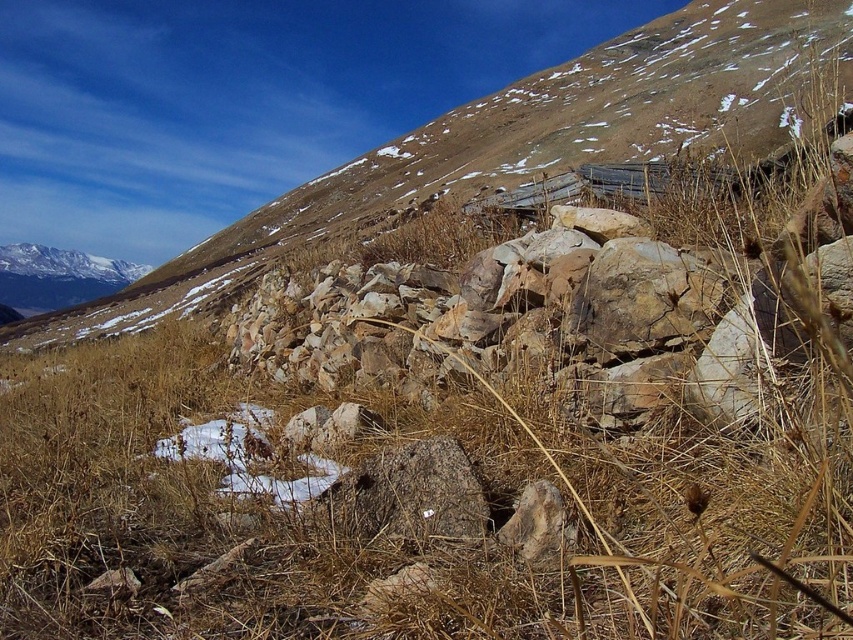
Does point (579, 461) come farther from viewer compared to point (677, 342)?

That is False.

This screenshot has width=853, height=640. Find the location of `dry grass at center`. dry grass at center is located at coordinates click(x=372, y=516).